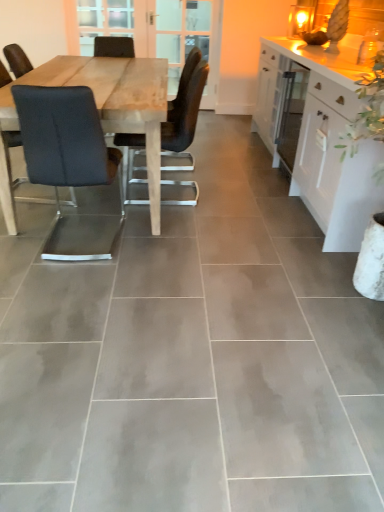
Locate an element on the screen. The height and width of the screenshot is (512, 384). free point to the right of black fabric chair at left, positioned as the second chair in right-to-left order is located at coordinates tap(172, 243).